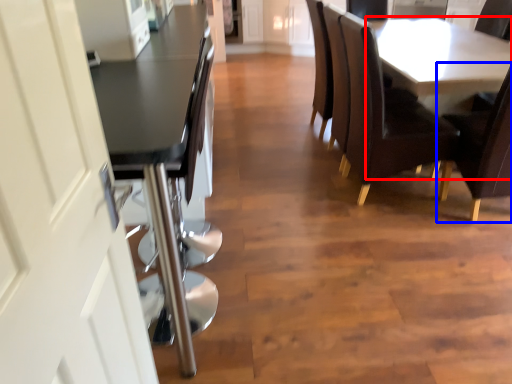
Question: Which point is further to the camera, table (highlighted by a red box) or chair (highlighted by a blue box)?

Choices:
 (A) table
 (B) chair

Answer: (A)